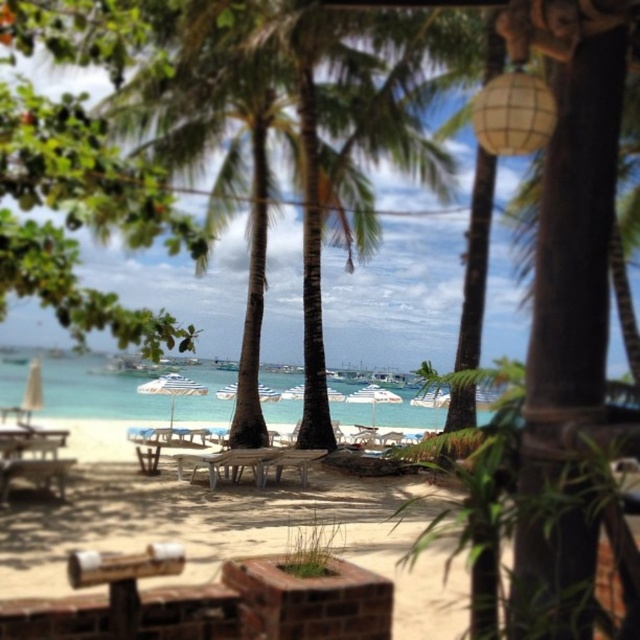
Can you confirm if clear blue water at center is positioned to the left of wooden table at center?

Indeed, clear blue water at center is positioned on the left side of wooden table at center.

Can you confirm if clear blue water at center is thinner than wooden table at center?

Incorrect, clear blue water at center's width is not less than wooden table at center's.

Is point (364, 387) less distant than point (305, 461)?

No, (364, 387) is further to viewer.

Find the location of a particular element. The image size is (640, 640). clear blue water at center is located at coordinates point(128,392).

Which is below, clear blue water at center or wooden picnic table at lower left?

wooden picnic table at lower left is lower down.

Is clear blue water at center above wooden picnic table at lower left?

Yes.

Which is in front, point (292, 397) or point (52, 442)?

Positioned in front is point (52, 442).

This screenshot has width=640, height=640. What are the coordinates of `clear blue water at center` in the screenshot? It's located at (128, 392).

Is brick textured bench at center wider than wooden table at center?

Yes.

Is point (264, 548) positioned in front of point (262, 465)?

That is True.

You are a GUI agent. You are given a task and a screenshot of the screen. Output one action in this format:
    pyautogui.click(x=<x>, y=<y>)
    Task: Click on the brick textured bench at center
    
    Given the screenshot: What is the action you would take?
    pyautogui.click(x=209, y=564)